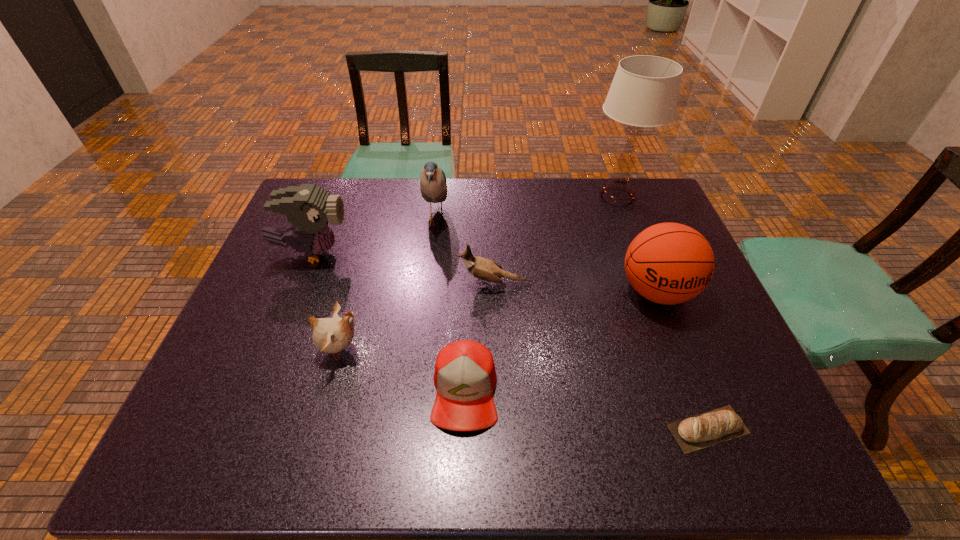
Identify the location of free space in the image that satisfies the following two spatial constraints: 1. on the back side of the shortest object; 2. at the beak of the third farthest object. (640, 253).

Locate an element on the screen. Image resolution: width=960 pixels, height=540 pixels. vacant position in the image that satisfies the following two spatial constraints: 1. on the side with logo of the basketball; 2. at the beak of the nearest bird is located at coordinates (680, 349).

Image resolution: width=960 pixels, height=540 pixels. I want to click on vacant region that satisfies the following two spatial constraints: 1. on the side with logo of the basketball; 2. at the beak of the nearest bird, so click(x=680, y=349).

I want to click on vacant space that satisfies the following two spatial constraints: 1. on the front-facing side of the table lamp; 2. on the front-facing side of the baseball cap, so click(690, 391).

Find the location of a particular element. This screenshot has height=540, width=960. free space in the image that satisfies the following two spatial constraints: 1. at the face of the third farthest bird; 2. on the front-facing side of the baseball cap is located at coordinates (498, 391).